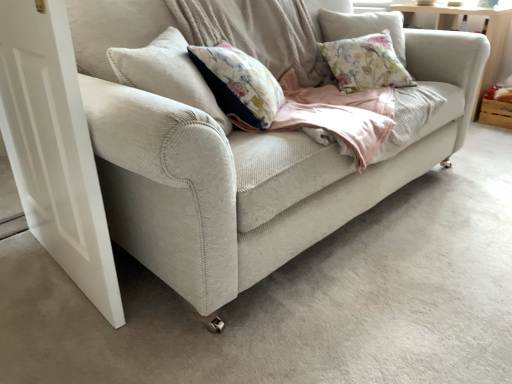
Question: From a real-world perspective, is light beige fabric couch at center positioned over white matte door at left based on gravity?

Choices:
 (A) yes
 (B) no

Answer: (A)

Question: Is white matte door at left at the back of light beige fabric couch at center?

Choices:
 (A) yes
 (B) no

Answer: (B)

Question: From a real-world perspective, is light beige fabric couch at center beneath white matte door at left?

Choices:
 (A) no
 (B) yes

Answer: (A)

Question: Is light beige fabric couch at center aimed at white matte door at left?

Choices:
 (A) yes
 (B) no

Answer: (B)

Question: Are light beige fabric couch at center and white matte door at left located far from each other?

Choices:
 (A) no
 (B) yes

Answer: (A)

Question: From the image's perspective, is light beige fabric couch at center under white matte door at left?

Choices:
 (A) yes
 (B) no

Answer: (B)

Question: From a real-world perspective, is light beige fabric couch at center beneath wooden crate at right?

Choices:
 (A) yes
 (B) no

Answer: (B)

Question: Does light beige fabric couch at center have a greater height compared to wooden crate at right?

Choices:
 (A) yes
 (B) no

Answer: (A)

Question: Can you confirm if light beige fabric couch at center is thinner than wooden crate at right?

Choices:
 (A) no
 (B) yes

Answer: (A)

Question: Considering the relative sizes of light beige fabric couch at center and wooden crate at right in the image provided, is light beige fabric couch at center wider than wooden crate at right?

Choices:
 (A) no
 (B) yes

Answer: (B)

Question: Is light beige fabric couch at center positioned in front of wooden crate at right?

Choices:
 (A) yes
 (B) no

Answer: (A)

Question: Is light beige fabric couch at center surrounding wooden crate at right?

Choices:
 (A) no
 (B) yes

Answer: (A)

Question: Is white matte door at left further to camera compared to wooden crate at right?

Choices:
 (A) no
 (B) yes

Answer: (A)